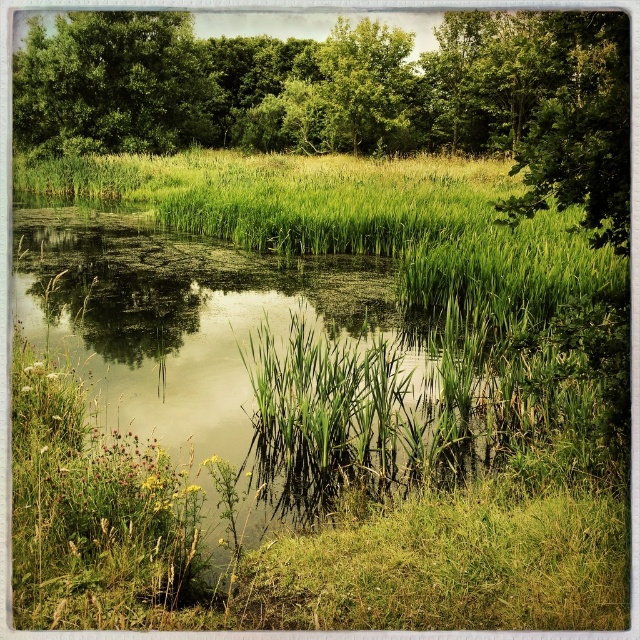
You are standing at the edge of the water and want to take a photo of both the green leafy tree at center and the green leafy tree at upper left. Which tree should you focus on first if you want to include both in your frame without moving your camera?

You should focus on the green leafy tree at center first because it is bigger and will require more space in the frame to capture its details, ensuring both trees are visible.

You are a bird seeking a nesting spot. You notice two green leafy trees in the scene. Which tree would provide a wider area for nesting, the green leafy tree at center or the green leafy tree at upper left?

The green leafy tree at center is wider than the green leafy tree at upper left, so it would provide a wider area for nesting.

You are standing at the point marked by the coordinates point (349, 97) in the image. What object is directly in front of you?

The point (349, 97) indicates green leafy tree at center, so the object directly in front of you is the green leafy tree at center.